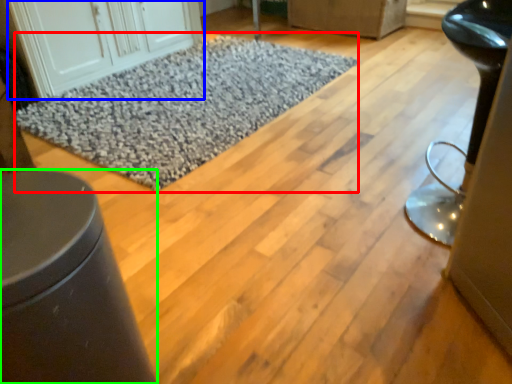
Question: Based on their relative distances, which object is farther from mat (highlighted by a red box)? Choose from cabinetry (highlighted by a blue box) and furniture (highlighted by a green box).

Choices:
 (A) cabinetry
 (B) furniture

Answer: (B)